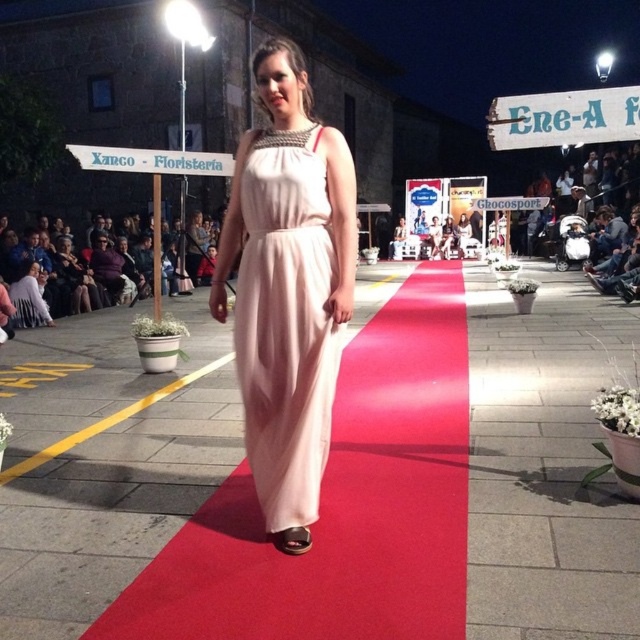
Where is the matte pink dress at center located in the image?

The matte pink dress at center is located at the 2D coordinates point (x=285, y=323).

From the picture: You are a photographer at the fashion show. You want to take a closeup shot of the matte pink dress at center and the matte pink sandal at center. Which object should you zoom in on more to capture both clearly?

The matte pink dress at center is larger in size than the matte pink sandal at center, so you should zoom in more on the matte pink sandal to ensure both are captured clearly.

You are a photographer positioned at the camera. You want to capture a closeup of the matte pink dress at center. Considering your current position, is the dress within a 2 meter distance for a clear closeup shot?

The matte pink dress at center is 1.95 meters from camera, which is within the 2 meter distance, so yes, the dress is close enough for a clear closeup shot.